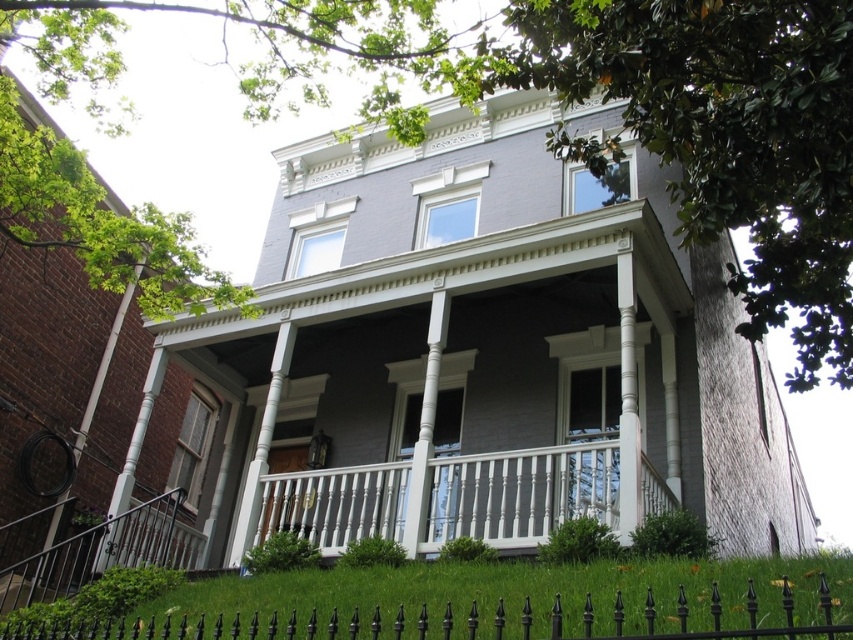
Question: Does white painted wood porch at center lie in front of black wrought iron fence at lower center?

Choices:
 (A) no
 (B) yes

Answer: (A)

Question: Among these points, which one is farthest from the camera?

Choices:
 (A) (341, 628)
 (B) (611, 524)

Answer: (B)

Question: Among these points, which one is nearest to the camera?

Choices:
 (A) (440, 509)
 (B) (409, 628)

Answer: (B)

Question: Is white painted wood porch at center smaller than black wrought iron fence at lower center?

Choices:
 (A) no
 (B) yes

Answer: (B)

Question: Can you confirm if white painted wood porch at center is positioned to the right of black wrought iron fence at lower center?

Choices:
 (A) yes
 (B) no

Answer: (A)